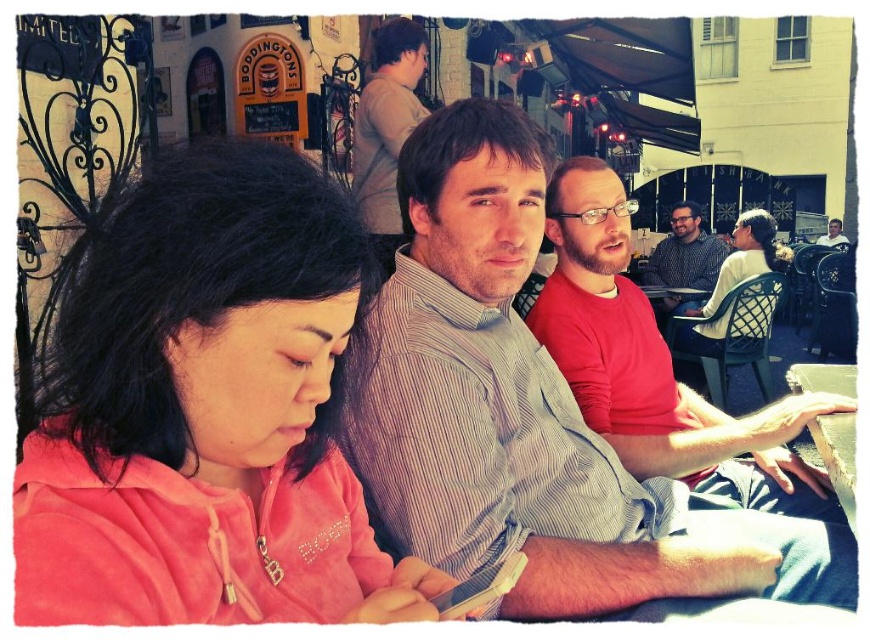
You are standing at the entrance of the outdoor cafe and want to locate the red cotton shirt at center. According to the coordinates provided, in which direction should you look to find it?

The red cotton shirt at center is located at coordinates point [656,365], so you should look towards the center of the image slightly to the right and above your current position.